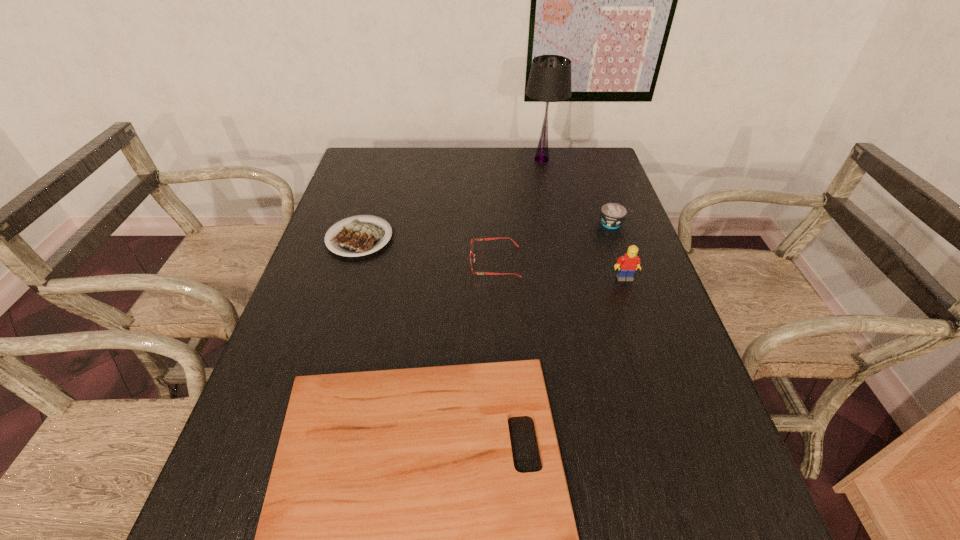
Image resolution: width=960 pixels, height=540 pixels. Identify the location of object that is the fourth closest to the lampshade. pyautogui.click(x=627, y=264).

At what (x,y) coordinates should I click in order to perform the action: click on vacant space that satisfies the following two spatial constraints: 1. on the back side of the fourth shortest object; 2. on the front-facing side of the tallest object. Please return your answer as a coordinate pair (x, y). The width and height of the screenshot is (960, 540). Looking at the image, I should click on (590, 159).